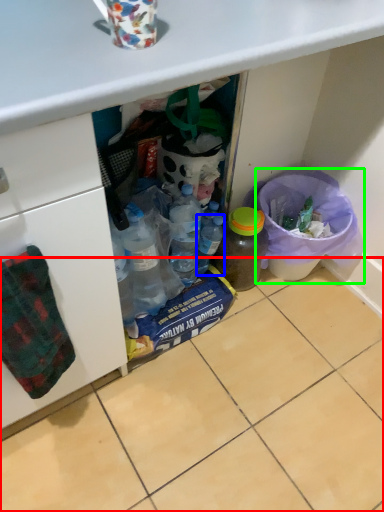
Question: Estimate the real-world distances between objects in this image. Which object is closer to tile (highlighted by a red box), bottle (highlighted by a blue box) or recycling bin (highlighted by a green box)?

Choices:
 (A) bottle
 (B) recycling bin

Answer: (B)